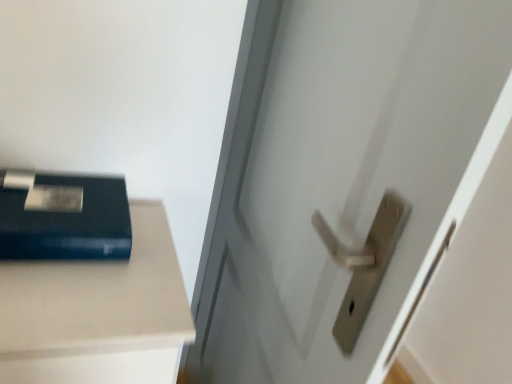
Find the location of `satin silver handle at center`. satin silver handle at center is located at coordinates (343, 181).

What do you see at coordinates (343, 181) in the screenshot? I see `satin silver handle at center` at bounding box center [343, 181].

Image resolution: width=512 pixels, height=384 pixels. What do you see at coordinates (64, 218) in the screenshot?
I see `matte black book at upper left` at bounding box center [64, 218].

This screenshot has height=384, width=512. Find the location of `matte black book at upper left`. matte black book at upper left is located at coordinates (64, 218).

Where is `satin silver handle at center`? satin silver handle at center is located at coordinates (343, 181).

Is satin silver handle at center at the right side of matte black book at upper left?

Correct, you'll find satin silver handle at center to the right of matte black book at upper left.

Considering the positions of objects satin silver handle at center and matte black book at upper left in the image provided, who is behind, satin silver handle at center or matte black book at upper left?

Positioned behind is matte black book at upper left.

Is point (454, 23) behind point (38, 258)?

No, (454, 23) is in front of (38, 258).

From the image's perspective, is satin silver handle at center above or below matte black book at upper left?

Based on their image positions, satin silver handle at center is located beneath matte black book at upper left.

From a real-world perspective, does satin silver handle at center stand above matte black book at upper left?

No, from a real-world perspective, satin silver handle at center is not over matte black book at upper left

From the picture: In terms of width, does satin silver handle at center look wider or thinner when compared to matte black book at upper left?

satin silver handle at center is thinner than matte black book at upper left.

Does satin silver handle at center have a lesser height compared to matte black book at upper left?

No.

Consider the image. Who is smaller, satin silver handle at center or matte black book at upper left?

matte black book at upper left is smaller.

Could matte black book at upper left be considered to be inside satin silver handle at center?

No, matte black book at upper left is not a part of satin silver handle at center.

Is satin silver handle at center directly adjacent to matte black book at upper left?

There is a gap between satin silver handle at center and matte black book at upper left.

Is satin silver handle at center turned away from matte black book at upper left?

Yes, satin silver handle at center is facing away from matte black book at upper left.

Can you tell me how much satin silver handle at center and matte black book at upper left differ in facing direction?

satin silver handle at center and matte black book at upper left are facing 79.9 degrees away from each other.

At what (x,y) coordinates should I click in order to perform the action: click on door beneath the matte black book at upper left (from a real-world perspective). Please return your answer as a coordinate pair (x, y). Looking at the image, I should click on (343, 181).

Considering the relative positions of matte black book at upper left and satin silver handle at center in the image provided, is matte black book at upper left to the left of satin silver handle at center from the viewer's perspective?

Indeed, matte black book at upper left is positioned on the left side of satin silver handle at center.

Does matte black book at upper left lie in front of satin silver handle at center?

No.

Considering the positions of points (33, 173) and (230, 326), is point (33, 173) farther from camera compared to point (230, 326)?

That is False.

From the image's perspective, between matte black book at upper left and satin silver handle at center, which one is located above?

matte black book at upper left is shown above in the image.

From a real-world perspective, which object rests below the other?

satin silver handle at center is physically lower.

Considering the sizes of objects matte black book at upper left and satin silver handle at center in the image provided, who is wider, matte black book at upper left or satin silver handle at center?

With larger width is matte black book at upper left.

Does matte black book at upper left have a lesser height compared to satin silver handle at center?

Yes.

Is matte black book at upper left bigger or smaller than satin silver handle at center?

Clearly, matte black book at upper left is smaller in size than satin silver handle at center.

Could satin silver handle at center be considered to be inside matte black book at upper left?

That's incorrect, satin silver handle at center is not inside matte black book at upper left.

Does matte black book at upper left touch satin silver handle at center?

No, matte black book at upper left is not touching satin silver handle at center.

Is matte black book at upper left oriented towards satin silver handle at center?

No, matte black book at upper left does not turn towards satin silver handle at center.

This screenshot has height=384, width=512. In the image, there is a matte black book at upper left. In order to click on door below it (from a real-world perspective) in this screenshot , I will do `click(343, 181)`.

Locate an element on the screen. This screenshot has width=512, height=384. paperback book located above the satin silver handle at center (from the image's perspective) is located at coordinates (64, 218).

The height and width of the screenshot is (384, 512). Identify the location of paperback book on the left of satin silver handle at center. point(64,218).